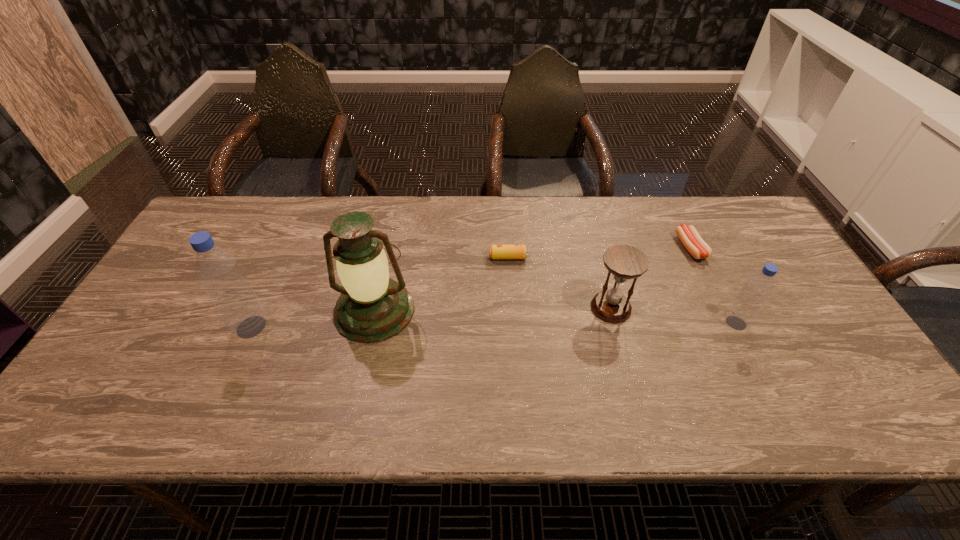
You are a GUI agent. You are given a task and a screenshot of the screen. Output one action in this format:
    pyautogui.click(x=<x>, y=<y>)
    Task: Click on the free point that satisfies the following two spatial constraints: 1. on the back side of the sausage; 2. on the left side of the fourth object from right to left
    Image resolution: width=960 pixels, height=540 pixels.
    Given the screenshot: What is the action you would take?
    pyautogui.click(x=507, y=248)

What are the coordinates of `free region that satisfies the following two spatial constraints: 1. on the back side of the left bottle; 2. on the right side of the fourth object from left to right` in the screenshot? It's located at (260, 308).

This screenshot has width=960, height=540. Identify the location of free location that satisfies the following two spatial constraints: 1. on the front side of the sausage; 2. on the left side of the right bottle. (728, 323).

What are the coordinates of `vacant space that satisfies the following two spatial constraints: 1. on the back side of the sausage; 2. on the right side of the left bottle` in the screenshot? It's located at (287, 248).